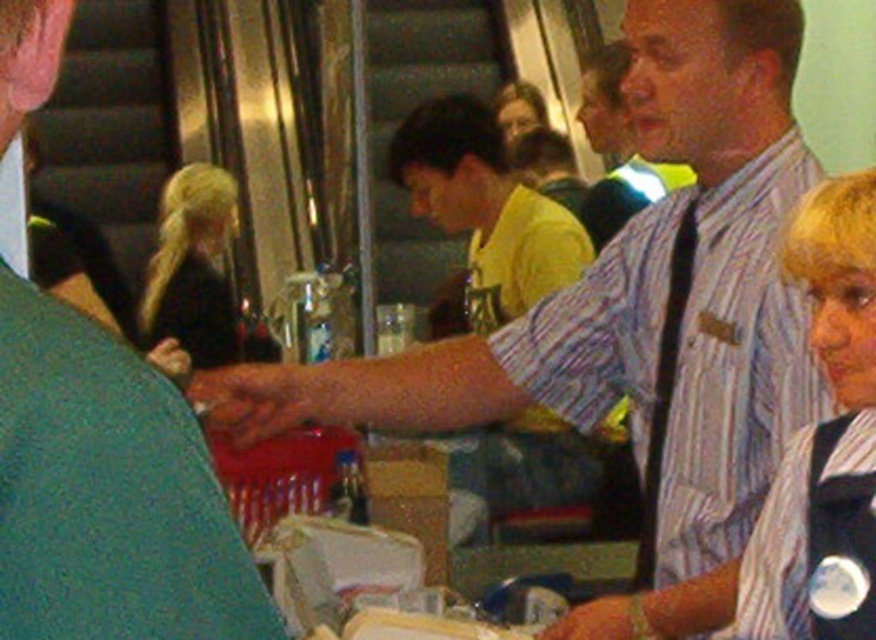
I want to click on black fabric vest at right, so click(x=795, y=468).

Does black fabric vest at right appear under yellow matte shirt at center?

Indeed, black fabric vest at right is positioned under yellow matte shirt at center.

Where is `black fabric vest at right`? black fabric vest at right is located at coordinates (795, 468).

The height and width of the screenshot is (640, 876). I want to click on black fabric vest at right, so click(x=795, y=468).

Who is taller, matte blue shirt at center or yellow matte shirt at center?

With more height is yellow matte shirt at center.

Is point (11, 552) positioned behind point (516, 257)?

No, (11, 552) is closer to viewer.

Who is more distant from viewer, (83, 424) or (436, 173)?

The point (436, 173) is behind.

The width and height of the screenshot is (876, 640). What are the coordinates of `matte blue shirt at center` in the screenshot? It's located at (108, 493).

Does matte blue shirt at center have a smaller size compared to black fabric vest at right?

Yes.

Is matte blue shirt at center wider than black fabric vest at right?

No.

Who is more forward, [163,378] or [855,493]?

Point [163,378] is in front.

Where is `matte blue shirt at center`? matte blue shirt at center is located at coordinates (108, 493).